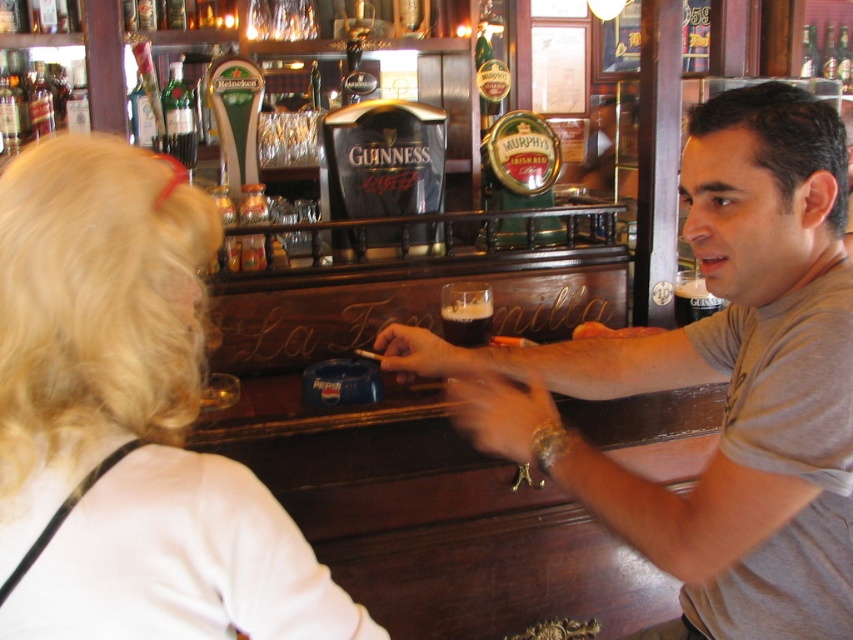
Which is more to the left, blonde hair at upper left or dark brown liquid at bar center?

blonde hair at upper left

Is blonde hair at upper left smaller than dark brown liquid at bar center?

Actually, blonde hair at upper left might be larger than dark brown liquid at bar center.

Is point (218, 480) farther from camera compared to point (680, 276)?

No, it is not.

Locate an element on the screen. This screenshot has height=640, width=853. blonde hair at upper left is located at coordinates (128, 419).

In order to click on green glass bottle at upper left in this screenshot , I will do `click(178, 116)`.

Does point (190, 170) lie behind point (463, 332)?

Yes, point (190, 170) is behind point (463, 332).

At what (x,y) coordinates should I click in order to perform the action: click on green glass bottle at upper left. Please return your answer as a coordinate pair (x, y). This screenshot has height=640, width=853. Looking at the image, I should click on (178, 116).

Between matte gray shirt at center and green glass bottle at upper left, which one is positioned higher?

green glass bottle at upper left is above.

Between point (761, 390) and point (183, 120), which one is positioned behind?

Point (183, 120)

Measure the distance between matte gray shirt at center and camera.

84.45 centimeters

Identify the location of matte gray shirt at center. (712, 381).